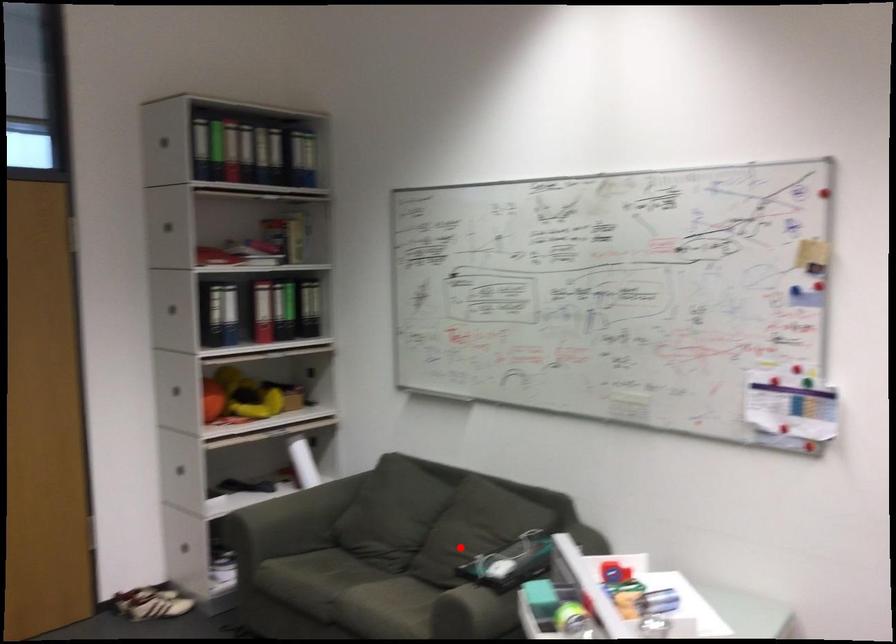
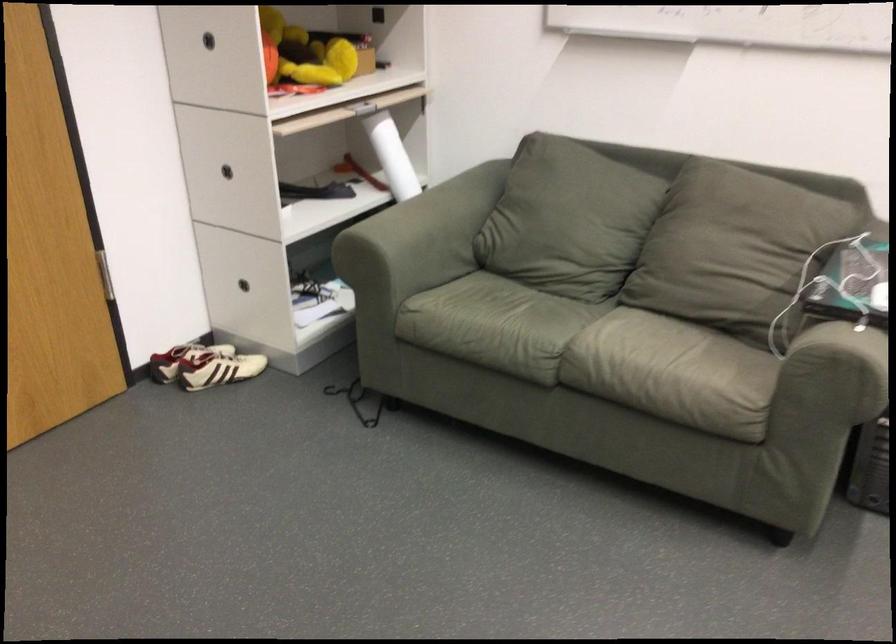
Question: I am providing you with two images of the same scene from different viewpoints. In image1, a red point is highlighted. Considering the same 3D point in image2, which of the following is correct?

Choices:
 (A) It is closer
 (B) It is farther

Answer: (A)